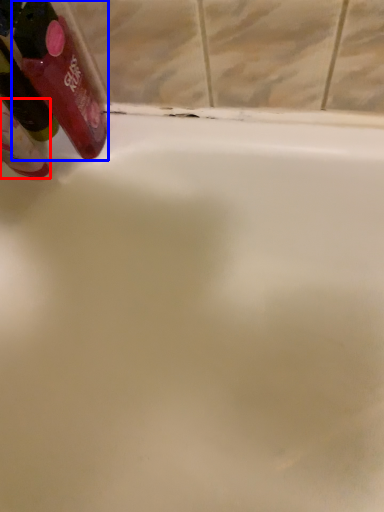
Question: Which point is further to the camera, mouthwash (highlighted by a red box) or mouthwash (highlighted by a blue box)?

Choices:
 (A) mouthwash
 (B) mouthwash

Answer: (A)